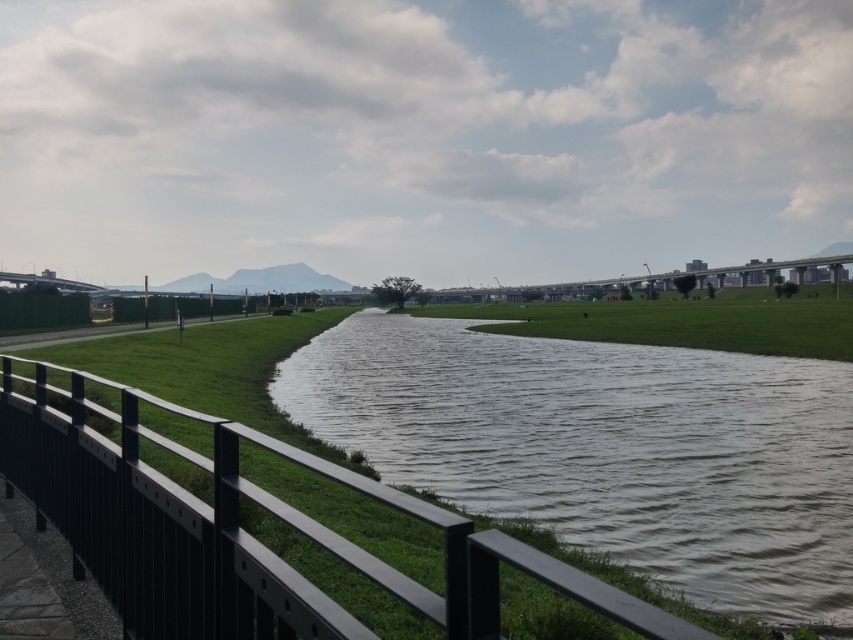
Question: Is black metal rail at center further to camera compared to green grass at center?

Choices:
 (A) no
 (B) yes

Answer: (A)

Question: Estimate the real-world distances between objects in this image. Which object is farther from the green grass at center?

Choices:
 (A) black metal rail at center
 (B) brown matte water at center

Answer: (A)

Question: From the image, what is the correct spatial relationship of black metal rail at center in relation to green grass at center?

Choices:
 (A) above
 (B) below

Answer: (B)

Question: Can you confirm if black metal rail at center is positioned above green grass at center?

Choices:
 (A) no
 (B) yes

Answer: (A)

Question: Among these objects, which one is nearest to the camera?

Choices:
 (A) black metal rail at center
 (B) green grass at center
 (C) brown matte water at center

Answer: (A)

Question: Which point appears closest to the camera in this image?

Choices:
 (A) (698, 461)
 (B) (485, 317)

Answer: (A)